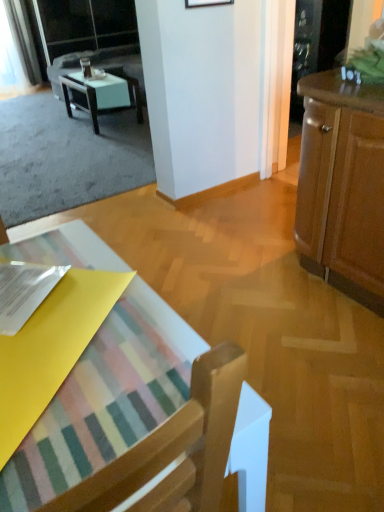
Image resolution: width=384 pixels, height=512 pixels. In order to click on transparent glass screen door at upper left, the first screen door in the top-to-bottom sequence in this screenshot , I will do `click(84, 25)`.

This screenshot has width=384, height=512. What do you see at coordinates (101, 65) in the screenshot?
I see `matte black couch at upper left` at bounding box center [101, 65].

This screenshot has height=512, width=384. What do you see at coordinates (206, 3) in the screenshot? I see `wooden picture frame at upper center` at bounding box center [206, 3].

What is the approximate height of wooden picture frame at upper center?

wooden picture frame at upper center is 16.22 inches tall.

What are the coordinates of `wooden cabinet at right` in the screenshot? It's located at (342, 186).

From a real-world perspective, is wooden picture frame at upper center over wooden chair at lower left?

Correct, in the physical world, wooden picture frame at upper center is higher than wooden chair at lower left.

Is wooden picture frame at upper center wider or thinner than wooden chair at lower left?

wooden picture frame at upper center is thinner than wooden chair at lower left.

From the image's perspective, between wooden picture frame at upper center and wooden chair at lower left, who is located below?

wooden chair at lower left appears lower in the image.

Can you confirm if white glossy table at upper left is bigger than transparent glass screen door at upper left, the 2th screen door from the right?

Actually, white glossy table at upper left might be smaller than transparent glass screen door at upper left, the 2th screen door from the right.

In the scene shown: Does white glossy table at upper left have a lesser height compared to transparent glass screen door at upper left, the 2th screen door from the right?

Yes, white glossy table at upper left is shorter than transparent glass screen door at upper left, the 2th screen door from the right.

Consider the image. Which is closer to the camera, (84, 106) or (136, 39)?

The point (84, 106) is closer.

From the picture: Considering the positions of objects white glossy table at upper left and transparent glass screen door at upper left, which appears as the first screen door when viewed from the left, in the image provided, who is more to the left, white glossy table at upper left or transparent glass screen door at upper left, which appears as the first screen door when viewed from the left,?

transparent glass screen door at upper left, which appears as the first screen door when viewed from the left.

Identify the location of screen door above the transparent glass cabinet at upper right, which is the 1th screen door from right to left (from the image's perspective). (84, 25).

What's the angular difference between transparent glass screen door at upper left, the 2th screen door from the right, and transparent glass cabinet at upper right, which ranks as the 1th screen door in front-to-back order,'s facing directions?

transparent glass screen door at upper left, the 2th screen door from the right, and transparent glass cabinet at upper right, which ranks as the 1th screen door in front-to-back order, are facing 91.3 degrees away from each other.

Does point (112, 35) appear closer or farther from the camera than point (299, 8)?

Point (112, 35) is farther from the camera than point (299, 8).

Between wooden cabinet at right and transparent glass screen door at upper left, the 2th screen door positioned from the front, which one has smaller size?

wooden cabinet at right.

The height and width of the screenshot is (512, 384). In order to click on cabinetry below the transparent glass screen door at upper left, the first screen door in the top-to-bottom sequence (from a real-world perspective) in this screenshot , I will do `click(342, 186)`.

Measure the distance between wooden cabinet at right and transparent glass screen door at upper left, the 2th screen door from the right.

They are 5.81 meters apart.

Is wooden cabinet at right located outside transparent glass screen door at upper left, the 2th screen door from the right?

wooden cabinet at right lies outside transparent glass screen door at upper left, the 2th screen door from the right,'s area.

Is white glossy table at upper left oriented away from wooden chair at lower left?

No, white glossy table at upper left's orientation is not away from wooden chair at lower left.

Is wooden chair at lower left inside white glossy table at upper left?

Actually, wooden chair at lower left is outside white glossy table at upper left.

Can you confirm if white glossy table at upper left is thinner than wooden chair at lower left?

Correct, the width of white glossy table at upper left is less than that of wooden chair at lower left.

Is white glossy table at upper left positioned in front of wooden chair at lower left?

No, white glossy table at upper left is further to the viewer.

Is wooden chair at lower left located within transparent glass cabinet at upper right, which ranks as the 1th screen door in front-to-back order?

No, transparent glass cabinet at upper right, which ranks as the 1th screen door in front-to-back order, does not contain wooden chair at lower left.

Which object is more forward, transparent glass cabinet at upper right, which is the 1th screen door from right to left, or wooden chair at lower left?

Positioned in front is wooden chair at lower left.

Is point (307, 3) more distant than point (171, 475)?

Yes, point (307, 3) is farther from viewer.

Measure the distance between transparent glass cabinet at upper right, acting as the 2th screen door starting from the left, and wooden chair at lower left.

The distance of transparent glass cabinet at upper right, acting as the 2th screen door starting from the left, from wooden chair at lower left is 3.99 meters.

Looking at this image, in the image, is transparent glass cabinet at upper right, acting as the second screen door starting from the back, positioned in front of or behind white glossy table at upper left?

Visually, transparent glass cabinet at upper right, acting as the second screen door starting from the back, is located in front of white glossy table at upper left.

Could you measure the distance between transparent glass cabinet at upper right, which is the 1th screen door from right to left, and white glossy table at upper left?

A distance of 6.27 feet exists between transparent glass cabinet at upper right, which is the 1th screen door from right to left, and white glossy table at upper left.

From a real-world perspective, who is located higher, transparent glass cabinet at upper right, which is the 1th screen door from right to left, or white glossy table at upper left?

transparent glass cabinet at upper right, which is the 1th screen door from right to left, from a real-world perspective.

Considering the points (320, 1) and (84, 96), which point is in front, point (320, 1) or point (84, 96)?

Point (320, 1)

Locate an element on the screen. This screenshot has width=384, height=512. chair in front of the wooden picture frame at upper center is located at coordinates (174, 448).

At what (x,y) coordinates should I click in order to perform the action: click on the 2nd screen door above when counting from the white glossy table at upper left (from the image's perspective). Please return your answer as a coordinate pair (x, y). Looking at the image, I should click on (84, 25).

Considering their positions, is matte black couch at upper left positioned further to wooden cabinet at right than white glossy table at upper left?

Among the two, matte black couch at upper left is located further to wooden cabinet at right.

Consider the image. Estimate the real-world distances between objects in this image. Which object is closer to white glossy table at upper left, wooden cabinet at right or wooden chair at lower left?

wooden cabinet at right is closer to white glossy table at upper left.

Based on the photo, looking at the image, which one is located closer to wooden picture frame at upper center, transparent glass screen door at upper left, the 2th screen door positioned from the front, or white glossy table at upper left?

Based on the image, white glossy table at upper left appears to be nearer to wooden picture frame at upper center.

Estimate the real-world distances between objects in this image. Which object is further from transparent glass cabinet at upper right, acting as the second screen door starting from the top, wooden cabinet at right or wooden picture frame at upper center?

wooden cabinet at right lies further to transparent glass cabinet at upper right, acting as the second screen door starting from the top, than the other object.

Considering their positions, is wooden picture frame at upper center positioned closer to transparent glass screen door at upper left, which ranks as the second screen door in bottom-to-top order, than matte black couch at upper left?

matte black couch at upper left.

Looking at the image, which one is located closer to matte black couch at upper left, wooden cabinet at right or transparent glass cabinet at upper right, acting as the 2th screen door starting from the left?

Among the two, transparent glass cabinet at upper right, acting as the 2th screen door starting from the left, is located nearer to matte black couch at upper left.

Considering their positions, is white glossy table at upper left positioned further to wooden picture frame at upper center than wooden chair at lower left?

white glossy table at upper left is positioned further to the anchor wooden picture frame at upper center.

Looking at the image, which one is located further to matte black couch at upper left, transparent glass screen door at upper left, which appears as the first screen door when viewed from the back, or wooden chair at lower left?

wooden chair at lower left.

The height and width of the screenshot is (512, 384). I want to click on table positioned between wooden chair at lower left and matte black couch at upper left from near to far, so click(x=101, y=94).

Where is `table located between wooden cabinet at right and transparent glass screen door at upper left, the 2th screen door from the right, in the depth direction`? This screenshot has height=512, width=384. table located between wooden cabinet at right and transparent glass screen door at upper left, the 2th screen door from the right, in the depth direction is located at coordinates (101, 94).

Identify the location of table between wooden cabinet at right and matte black couch at upper left in the front-back direction. The image size is (384, 512). (101, 94).

The image size is (384, 512). I want to click on couch between wooden picture frame at upper center and transparent glass screen door at upper left, the first screen door in the top-to-bottom sequence, from front to back, so click(x=101, y=65).